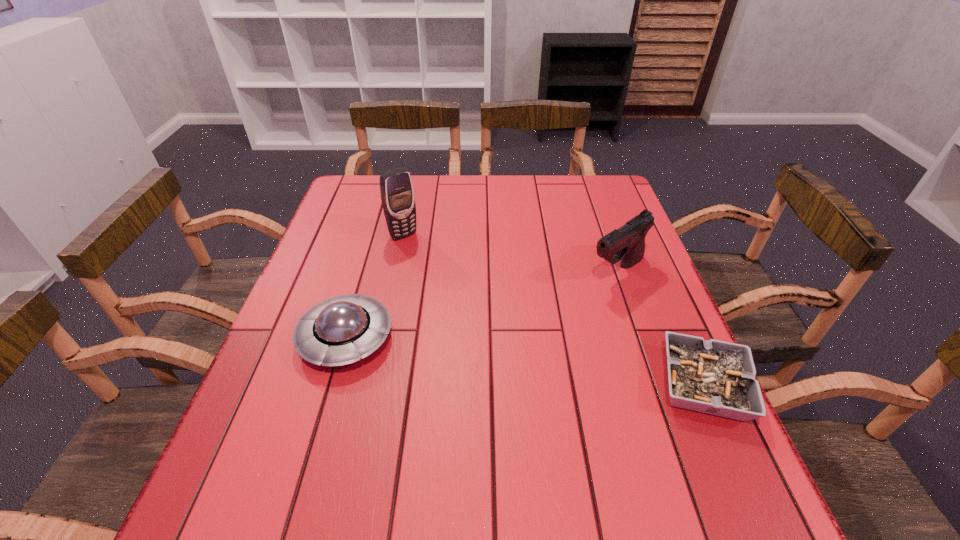
Where is `vacant space on the desktop that is between the saucer and the ashtray and is positioned on the front face of the farthest object`? The width and height of the screenshot is (960, 540). vacant space on the desktop that is between the saucer and the ashtray and is positioned on the front face of the farthest object is located at coordinates (523, 361).

In order to click on free space on the desktop that is between the second shortest object and the shortest object and is positioned at the barrel of the second farthest object in this screenshot , I will do `click(499, 358)`.